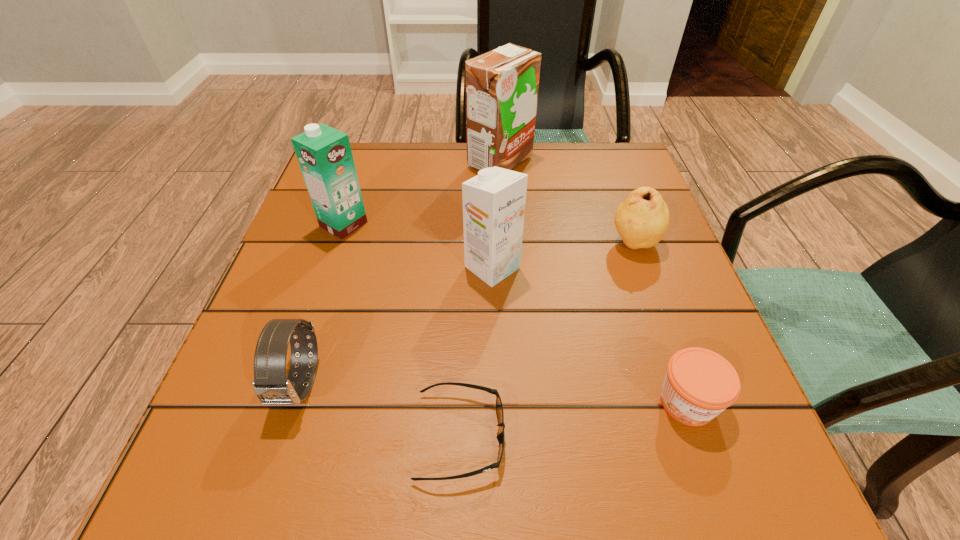
Identify which carton is the nearest to the second shortest object. Please provide its 2D coordinates. Your answer should be formatted as a tuple, i.e. [(x, y)], where the tuple contains the x and y coordinates of a point satisfying the conditions above.

[(494, 201)]

Find the location of `the closest carton relative to the leftmost carton`. the closest carton relative to the leftmost carton is located at coordinates (494, 201).

At what (x,y) coordinates should I click in order to perform the action: click on vacant region that satisfies the following two spatial constraints: 1. on the back side of the pear; 2. on the straw side of the farthest object. Please return your answer as a coordinate pair (x, y). The image size is (960, 540). Looking at the image, I should click on (604, 161).

Image resolution: width=960 pixels, height=540 pixels. What are the coordinates of `free point that satisfies the following two spatial constraints: 1. on the front label of the sixth tallest object; 2. on the front-facing side of the shortest object` in the screenshot? It's located at (699, 436).

Locate an element on the screen. free spot that satisfies the following two spatial constraints: 1. on the straw side of the farthest carton; 2. on the left side of the pear is located at coordinates (505, 242).

You are a GUI agent. You are given a task and a screenshot of the screen. Output one action in this format:
    pyautogui.click(x=<x>, y=<y>)
    Task: Click on the vacant region that satisfies the following two spatial constraints: 1. on the straw side of the farthest object; 2. on the front side of the nearest carton
    The image size is (960, 540).
    Given the screenshot: What is the action you would take?
    pyautogui.click(x=506, y=267)